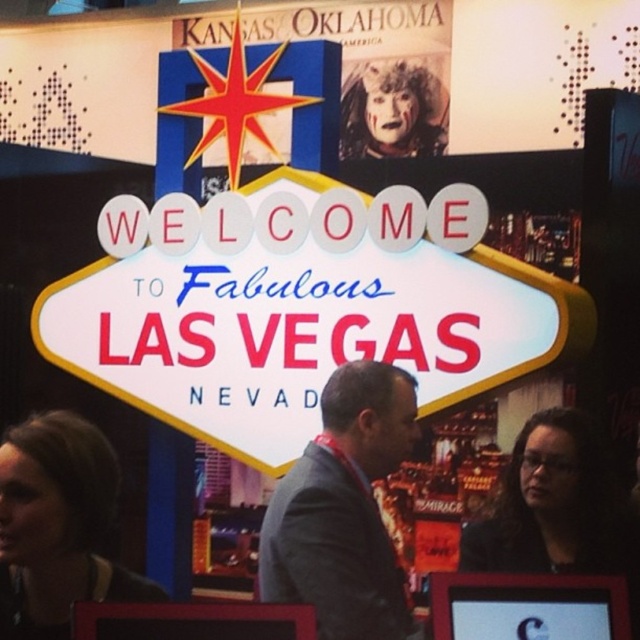
You are a photographer trying to capture the iconic Las Vegas sign. You notice two elements in the scene that might distract from the sign. The gray wool suit at center and the smooth black hair at lower left. Which of these elements is positioned lower in the frame?

The gray wool suit at center is positioned lower in the frame than the smooth black hair at lower left.

You are a photographer trying to capture the iconic Las Vegas sign. You notice two strands of hair, smooth black hair at lower left and black glossy hair at lower right, blocking your view. Which hair strand is closer to your camera lens?

The smooth black hair at lower left is closer to the camera lens because it is positioned in front of the black glossy hair at lower right.

You are an artist trying to sketch the scene. You notice two strands of hair in the Oklahoma poster. Which strand of hair is taller? The options are the smooth black hair at lower left and the black glossy hair at lower right.

The smooth black hair at lower left is taller than the black glossy hair at lower right.